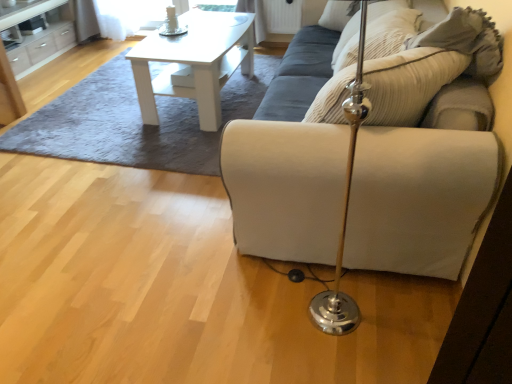
Question: From the image's perspective, is beige corduroy pillow at upper right, the 1th pillow in the back-to-front sequence, above or below white matte table at upper center?

Choices:
 (A) below
 (B) above

Answer: (B)

Question: Looking at the image, does beige corduroy pillow at upper right, placed as the second pillow when sorted from front to back, seem bigger or smaller compared to white matte table at upper center?

Choices:
 (A) small
 (B) big

Answer: (A)

Question: Which of these objects is positioned farthest from the beige fabric couch at center?

Choices:
 (A) beige corduroy pillow at upper right, the 1th pillow in the back-to-front sequence
 (B) white matte table at upper center
 (C) suede beige pillow at upper right, arranged as the 1th pillow when viewed from the front

Answer: (C)

Question: Based on their relative distances, which object is nearer to the beige fabric couch at center?

Choices:
 (A) white matte table at upper center
 (B) suede beige pillow at upper right, arranged as the 1th pillow when viewed from the front
 (C) beige corduroy pillow at upper right, placed as the second pillow when sorted from front to back

Answer: (C)